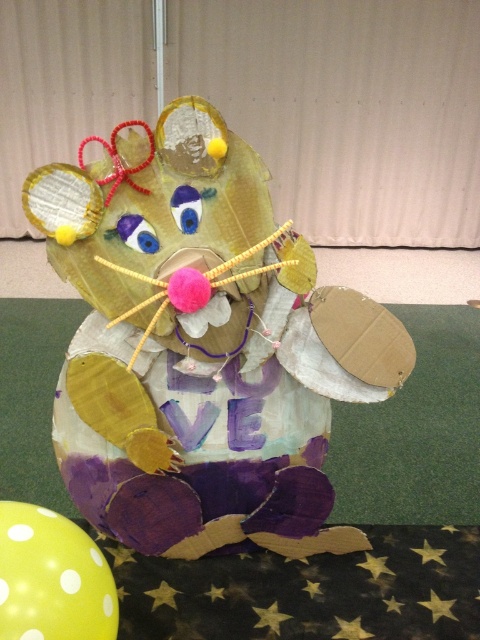
Is cardboard mouse at center taller than yellow dotted balloon at lower left?

Correct, cardboard mouse at center is much taller as yellow dotted balloon at lower left.

Locate an element on the screen. This screenshot has height=640, width=480. cardboard mouse at center is located at coordinates (202, 346).

Where is `cardboard mouse at center`? cardboard mouse at center is located at coordinates (202, 346).